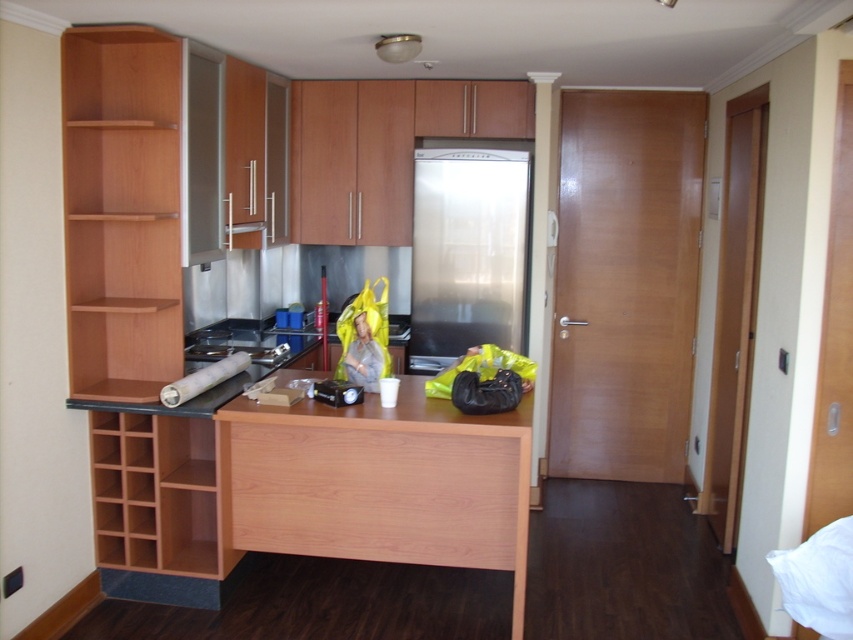
Question: Which point is closer to the camera?

Choices:
 (A) brushed metal sink at center
 (B) stainless steel refrigerator at center
 (C) light wood drawer at center

Answer: (C)

Question: Is the position of light brown wood shelf at left less distant than that of stainless steel refrigerator at center?

Choices:
 (A) yes
 (B) no

Answer: (A)

Question: Is stainless steel refrigerator at center above brushed metal sink at center?

Choices:
 (A) yes
 (B) no

Answer: (A)

Question: Which object appears closest to the camera in this image?

Choices:
 (A) stainless steel refrigerator at center
 (B) light wood drawer at center
 (C) light brown wood shelf at left

Answer: (B)

Question: Is light brown wood shelf at left below stainless steel refrigerator at center?

Choices:
 (A) no
 (B) yes

Answer: (A)

Question: Which of these objects is positioned closest to the light brown wood shelf at left?

Choices:
 (A) stainless steel refrigerator at center
 (B) brushed metal sink at center

Answer: (B)